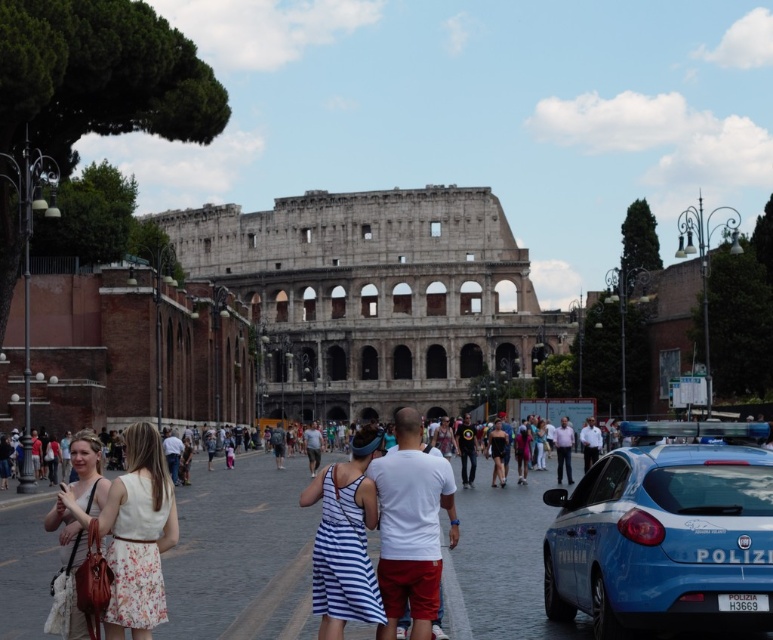
You are a photographer standing at the Colosseum and want to capture both the white floral dress at lower left and the white striped dress at center in a single photo. Which dress should you adjust your camera angle to include first if one is blocking the other?

The white striped dress at center is behind the white floral dress at lower left, so you should adjust your camera angle to include the white floral dress at lower left first since it is in front and might block the view of the striped dress.

You are standing at the Colosseum and want to take a photo of the white floral dress at lower left. The camera you have can focus on objects up to 100 meters away. Will the dress be in focus?

The white floral dress at lower left is 87.13 meters away from camera. Since the camera can focus up to 100 meters, the dress is within the focus range and will be in focus.